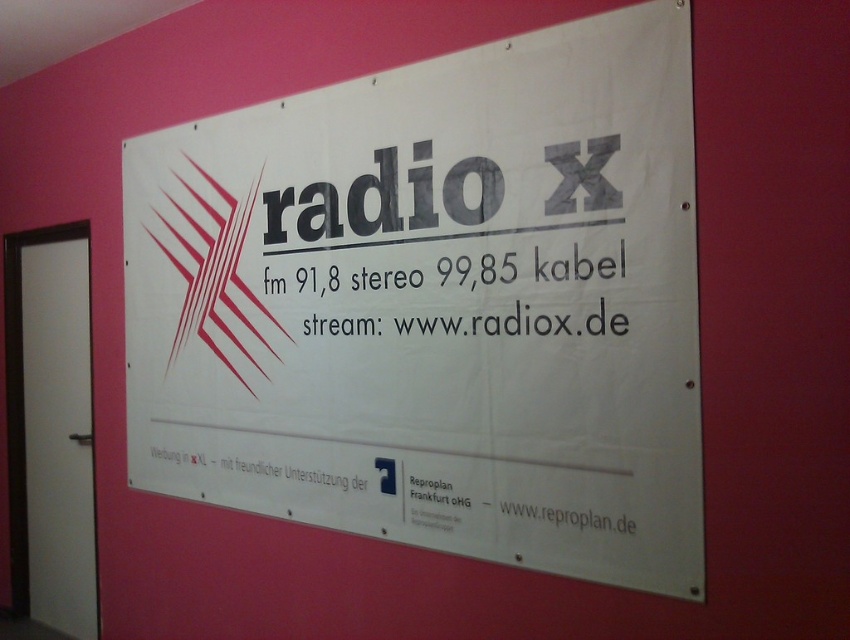
Question: Which object is farther from the camera taking this photo?

Choices:
 (A) white paper text at center
 (B) white paper poster at center
 (C) white text at center

Answer: (C)

Question: Which of the following is the closest to the observer?

Choices:
 (A) white paper text at center
 (B) white text at center

Answer: (A)

Question: Is white paper poster at center below white text at center?

Choices:
 (A) yes
 (B) no

Answer: (B)

Question: Does white paper poster at center have a greater width compared to white text at center?

Choices:
 (A) no
 (B) yes

Answer: (B)

Question: Considering the relative positions of white paper poster at center and white paper text at center in the image provided, where is white paper poster at center located with respect to white paper text at center?

Choices:
 (A) below
 (B) above

Answer: (A)

Question: Which object is the closest to the white text at center?

Choices:
 (A) white paper poster at center
 (B) white paper text at center

Answer: (B)